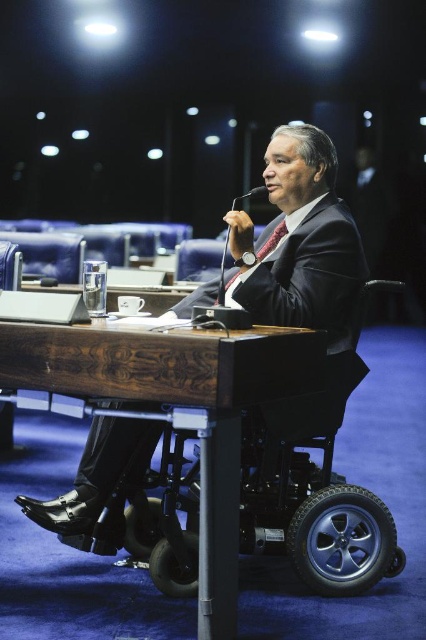
Which is above, matte black suit at center or black plastic microphone at center?

black plastic microphone at center is higher up.

Where is `matte black suit at center`? The height and width of the screenshot is (640, 426). matte black suit at center is located at coordinates (310, 276).

This screenshot has width=426, height=640. Describe the element at coordinates (310, 276) in the screenshot. I see `matte black suit at center` at that location.

Where is `matte black suit at center`? matte black suit at center is located at coordinates (310, 276).

Is red silk tie at center taller than black plastic microphone at center?

Yes.

Can you confirm if red silk tie at center is positioned to the right of black plastic microphone at center?

Incorrect, red silk tie at center is not on the right side of black plastic microphone at center.

I want to click on red silk tie at center, so click(x=271, y=241).

Can you confirm if matte black suit at center is thinner than red silk tie at center?

In fact, matte black suit at center might be wider than red silk tie at center.

Describe the element at coordinates (310, 276) in the screenshot. The width and height of the screenshot is (426, 640). I see `matte black suit at center` at that location.

Which is behind, point (334, 352) or point (224, 256)?

Point (334, 352)

Where is `matte black suit at center`? The image size is (426, 640). matte black suit at center is located at coordinates coord(310,276).